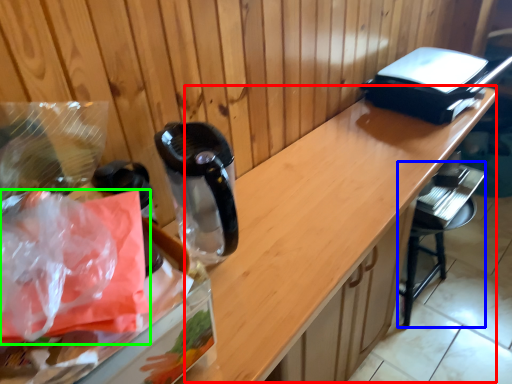
Question: Which object is positioned closest to counter (highlighted by a red box)? Select from bar stool (highlighted by a blue box) and plastic bag (highlighted by a green box).

Choices:
 (A) bar stool
 (B) plastic bag

Answer: (A)